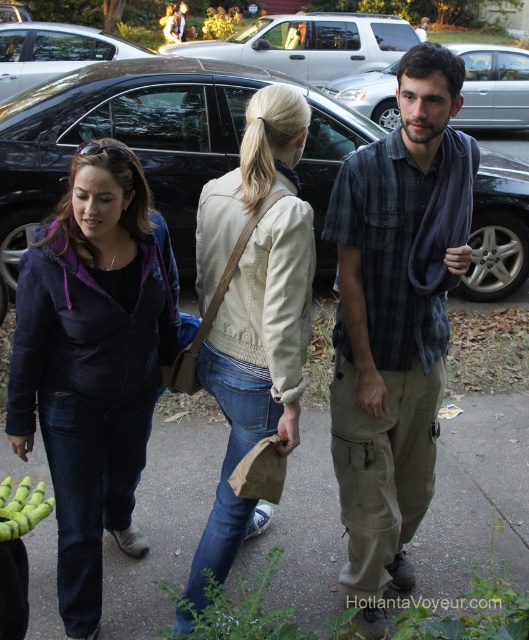
Who is taller, glossy black car at center or green matte tennis balls at lower left?

Standing taller between the two is glossy black car at center.

Is glossy black car at center taller than green matte tennis balls at lower left?

Indeed, glossy black car at center has a greater height compared to green matte tennis balls at lower left.

The height and width of the screenshot is (640, 529). What do you see at coordinates (53, 51) in the screenshot?
I see `glossy black car at center` at bounding box center [53, 51].

The height and width of the screenshot is (640, 529). What are the coordinates of `glossy black car at center` in the screenshot? It's located at (53, 51).

Does plaid cotton shirt at center have a smaller size compared to purple matte jacket at left?

No.

Consider the image. Is plaid cotton shirt at center taller than purple matte jacket at left?

Yes.

Is point (404, 413) positioned before point (136, 266)?

That is False.

This screenshot has width=529, height=640. I want to click on plaid cotton shirt at center, so click(x=394, y=323).

Is point (277, 168) more distant than point (294, 24)?

That is False.

This screenshot has width=529, height=640. In order to click on beige leather jacket at center in this screenshot , I will do `click(251, 310)`.

Who is more forward, [211,230] or [259,17]?

Point [211,230]

Find the location of a particular element. Image resolution: width=529 pixels, height=640 pixels. beige leather jacket at center is located at coordinates coord(251,310).